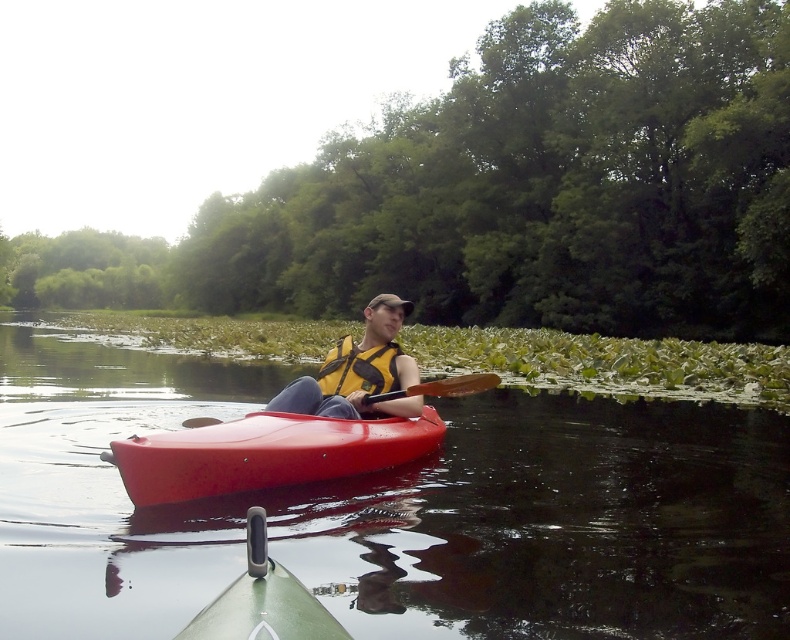
You are a safety inspector checking the equipment of the kayaker. You notice the yellow fabric life jacket at center and the brown wooden paddle at center. Which item is bigger in size?

The yellow fabric life jacket at center is larger in size compared to the brown wooden paddle at center.

From the picture: You are a GPS device trying to locate the yellow fabric life jacket at center in the image. What are its coordinates?

The yellow fabric life jacket at center is located at coordinates point (358, 369).